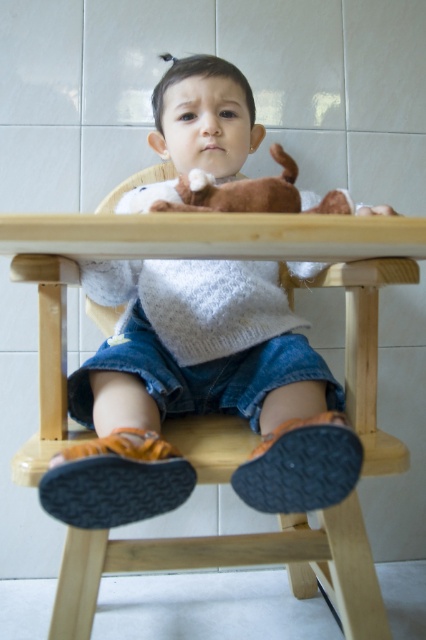
Question: Does white knitted sweater at center appear over wooden table at center?

Choices:
 (A) yes
 (B) no

Answer: (A)

Question: Can you confirm if white knitted sweater at center is thinner than wooden table at center?

Choices:
 (A) yes
 (B) no

Answer: (A)

Question: Among these objects, which one is farthest from the camera?

Choices:
 (A) white knitted sweater at center
 (B) wooden table at center

Answer: (A)

Question: Among these objects, which one is farthest from the camera?

Choices:
 (A) wooden table at center
 (B) white knitted sweater at center

Answer: (B)

Question: Where is white knitted sweater at center located in relation to wooden table at center in the image?

Choices:
 (A) below
 (B) above

Answer: (B)

Question: Which point is farther from the camera taking this photo?

Choices:
 (A) (160, 228)
 (B) (333, 397)

Answer: (B)